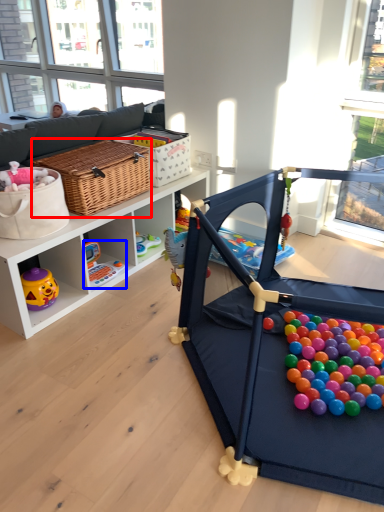
Question: Which of the following is the closest to the observer, picnic basket (highlighted by a red box) or toy (highlighted by a blue box)?

Choices:
 (A) picnic basket
 (B) toy

Answer: (A)